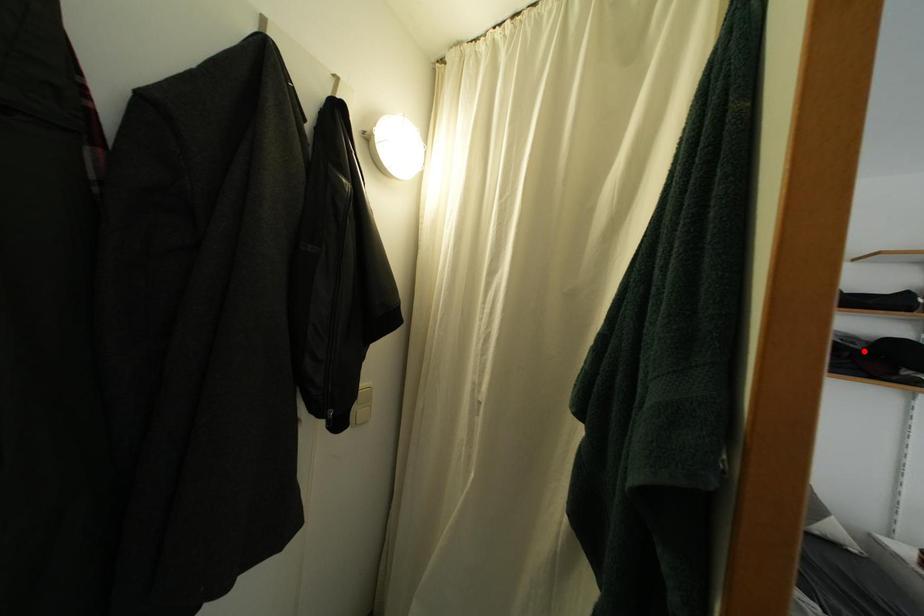
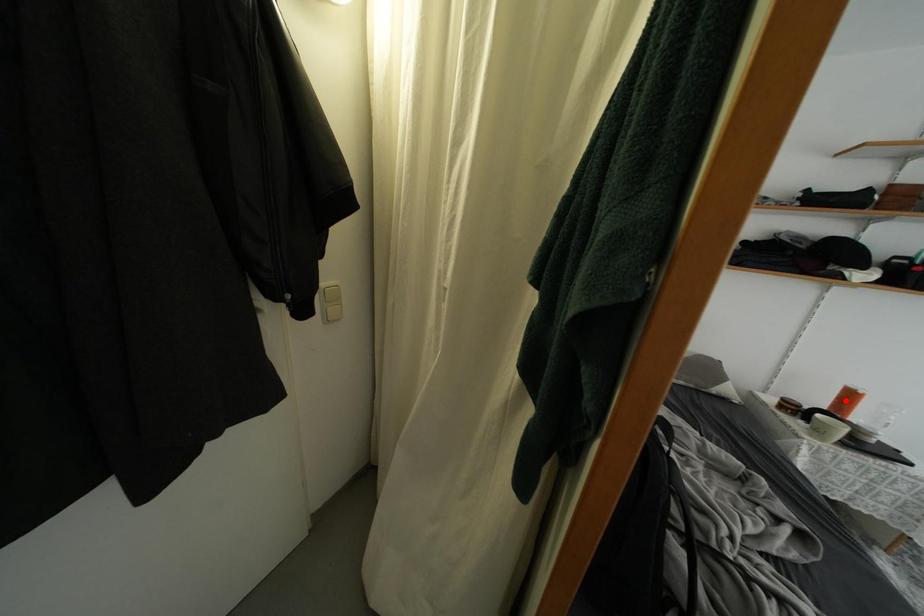
I am providing you with two images of the same scene from different viewpoints. A red point is marked on the first image and another point is marked on the second image. Is the red point in image1 aligned with the point shown in image2?

No